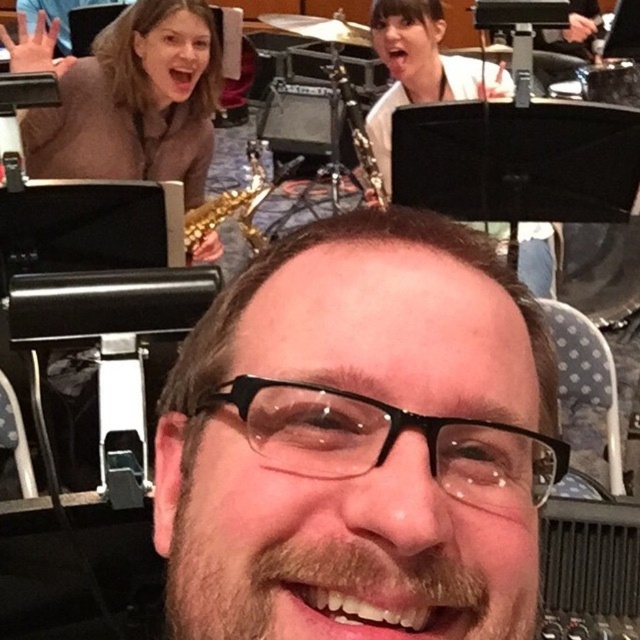
Question: Among these objects, which one is farthest from the camera?

Choices:
 (A) brown matte glasses at center
 (B) gold metallic saxophone at upper center

Answer: (B)

Question: Can you confirm if brown matte glasses at center is smaller than gold metallic saxophone at upper center?

Choices:
 (A) no
 (B) yes

Answer: (B)

Question: Can you confirm if brown matte glasses at center is thinner than gold metallic saxophone at upper center?

Choices:
 (A) yes
 (B) no

Answer: (B)

Question: From the image, what is the correct spatial relationship of brown matte glasses at center in relation to gold metallic saxophone at upper center?

Choices:
 (A) right
 (B) left

Answer: (B)

Question: Which of the following is the farthest from the observer?

Choices:
 (A) (272, 636)
 (B) (358, 161)

Answer: (B)

Question: Which point is farther to the camera?

Choices:
 (A) gold metallic saxophone at upper center
 (B) brown matte glasses at center

Answer: (A)